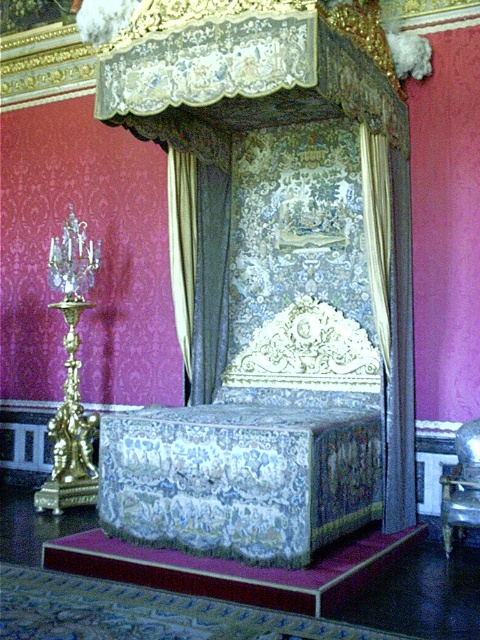
You are an interior designer planning to move a large antique wardrobe into the room. The wardrobe is 2 meters wide. You need to place it in a spot where it won not block the view of the silky brocade bed frame at center and the metallic silver bed at center. Based on their positions, which object should the wardrobe be placed closer to so it doesn t block both?

The silky brocade bed frame at center is positioned under the metallic silver bed at center. To avoid blocking both, the wardrobe should be placed closer to the metallic silver bed at center since it is above the silky brocade bed frame at center, allowing the wardrobe to be placed near the upper part without obstructing the lower bed frame.